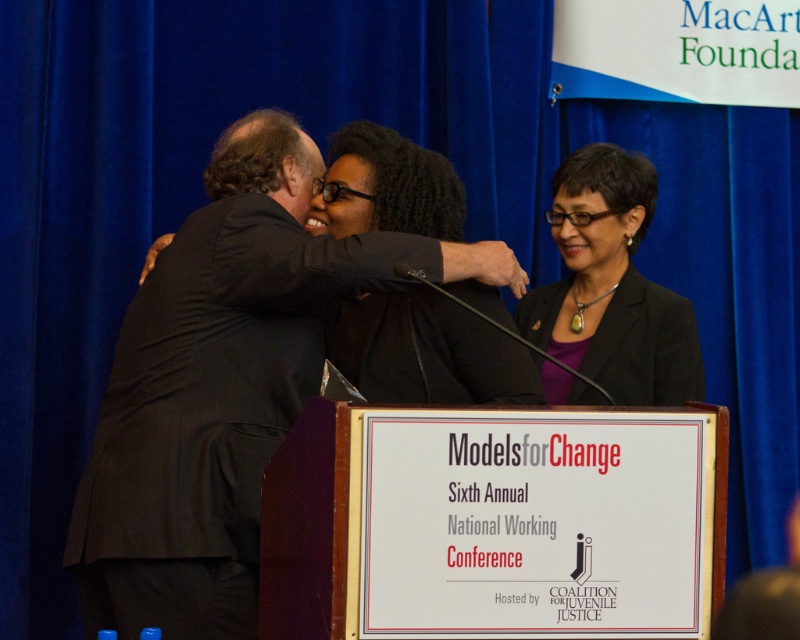
Question: Which point is closer to the camera?

Choices:
 (A) (608, 349)
 (B) (166, 298)

Answer: (B)

Question: Which object appears farthest from the camera in this image?

Choices:
 (A) matte black blazer at center
 (B) black suit at center

Answer: (A)

Question: Can you confirm if black suit at center is wider than matte black blazer at center?

Choices:
 (A) yes
 (B) no

Answer: (A)

Question: Which point appears farthest from the camera in this image?

Choices:
 (A) (270, 202)
 (B) (574, 224)

Answer: (B)

Question: In this image, where is black suit at center located relative to matte black blazer at center?

Choices:
 (A) right
 (B) left

Answer: (B)

Question: Is black suit at center behind matte black blazer at center?

Choices:
 (A) yes
 (B) no

Answer: (B)